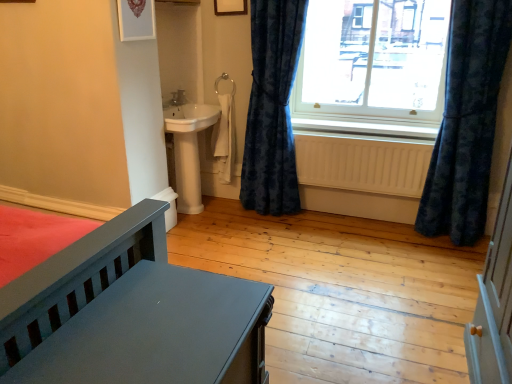
Question: Looking at the image, does beige wooden radiator at lower center seem bigger or smaller compared to velvet blue curtain at right, positioned as the first curtain in left-to-right order?

Choices:
 (A) small
 (B) big

Answer: (A)

Question: Considering the positions of point (418, 183) and point (252, 203), is point (418, 183) closer or farther from the camera than point (252, 203)?

Choices:
 (A) farther
 (B) closer

Answer: (B)

Question: Considering the real-world distances, which object is farthest from the transparent glass window at upper right?

Choices:
 (A) velvet dark blue curtain at right, which appears as the first curtain when viewed from the right
 (B) beige wooden radiator at lower center
 (C) white painted wood at lower center
 (D) matte gray bed at lower left
 (E) velvet blue curtain at right, positioned as the first curtain in left-to-right order

Answer: (D)

Question: Estimate the real-world distances between objects in this image. Which object is closer to the velvet blue curtain at right, which ranks as the second curtain in right-to-left order?

Choices:
 (A) transparent glass window at upper right
 (B) beige wooden radiator at lower center
 (C) matte gray bed at lower left
 (D) white painted wood at lower center
 (E) velvet dark blue curtain at right, which appears as the first curtain when viewed from the right

Answer: (B)